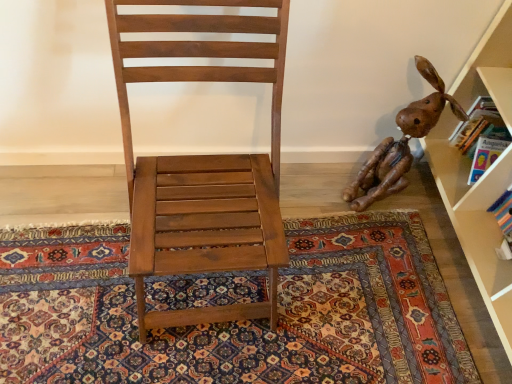
Where is `vacant region below carpeted floor at center (from a real-world perspective)`? vacant region below carpeted floor at center (from a real-world perspective) is located at coordinates (278, 291).